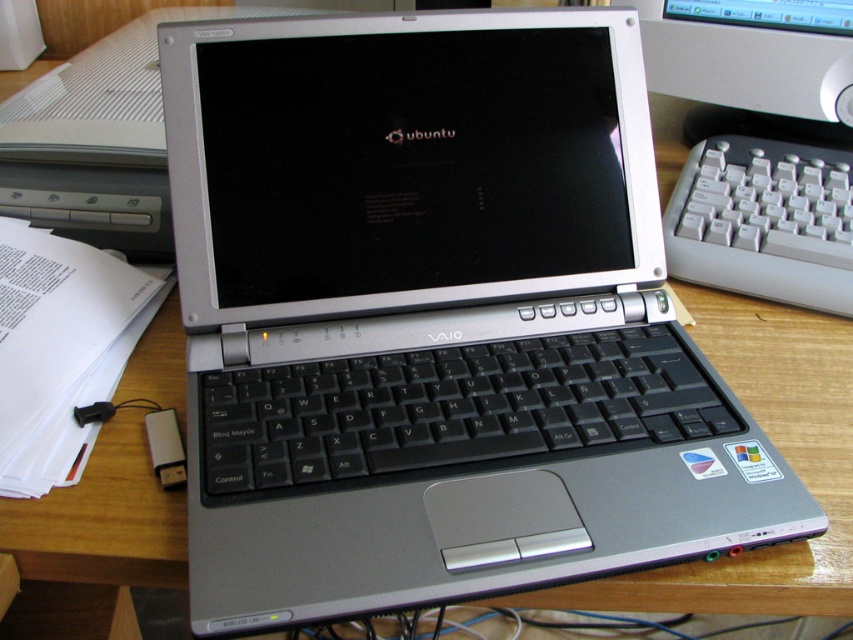
Does gray plastic keyboard at right come in front of matte black monitor at upper center?

Yes, gray plastic keyboard at right is in front of matte black monitor at upper center.

How distant is gray plastic keyboard at right from matte black monitor at upper center?

gray plastic keyboard at right is 4.37 inches away from matte black monitor at upper center.

Is point (811, 307) closer to viewer compared to point (811, 44)?

Yes, point (811, 307) is in front of point (811, 44).

The width and height of the screenshot is (853, 640). What are the coordinates of `gray plastic keyboard at right` in the screenshot? It's located at (764, 221).